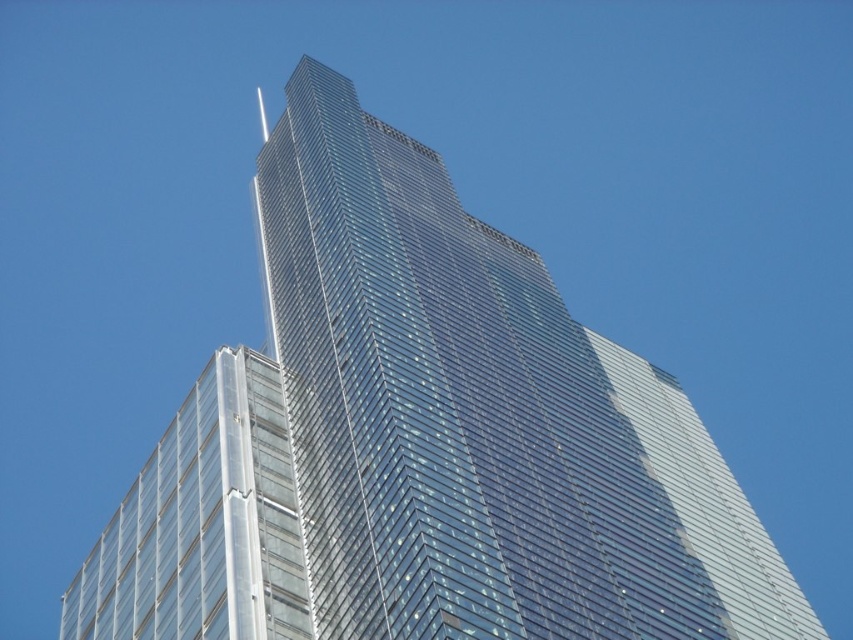
Is the position of transparent glass tower at center more distant than that of transparent glass building at lower left?

That is False.

Which is above, transparent glass tower at center or transparent glass building at lower left?

transparent glass tower at center is higher up.

The height and width of the screenshot is (640, 853). In order to click on transparent glass tower at center in this screenshot , I will do `click(480, 420)`.